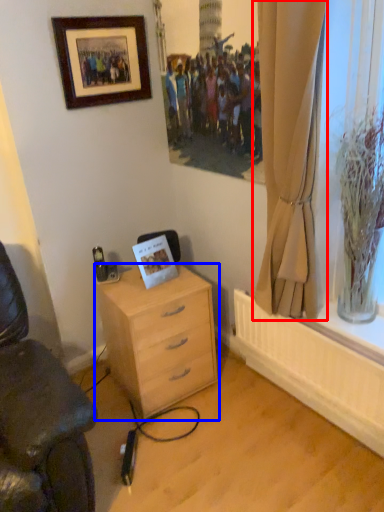
Question: Which object appears closest to the camera in this image, curtain (highlighted by a red box) or desk (highlighted by a blue box)?

Choices:
 (A) curtain
 (B) desk

Answer: (A)